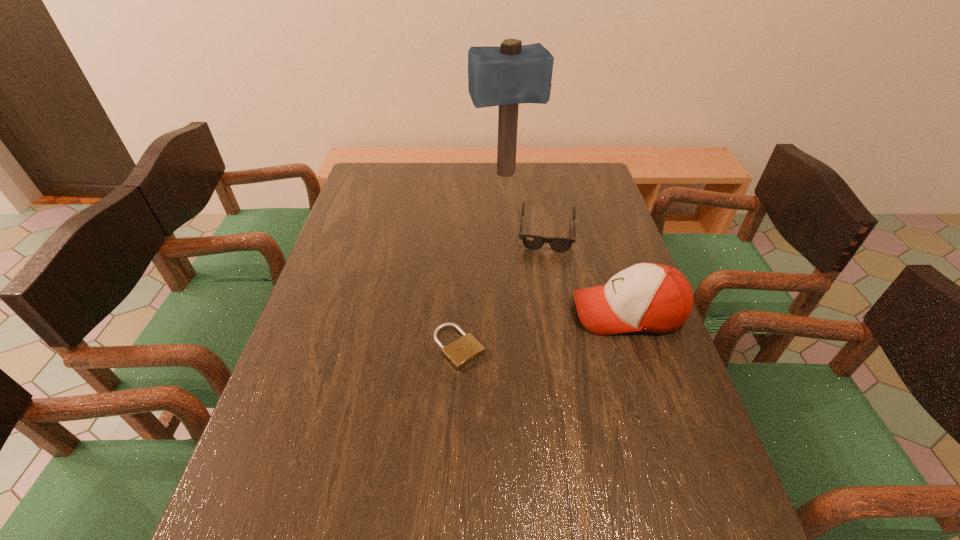
You are a GUI agent. You are given a task and a screenshot of the screen. Output one action in this format:
    pyautogui.click(x=<x>, y=<y>)
    Task: Click on the empty location between the second tallest object and the third nearest object
    This screenshot has height=540, width=960.
    Given the screenshot: What is the action you would take?
    pyautogui.click(x=588, y=273)

Where is `vacant space in between the third shortest object and the padlock`? The height and width of the screenshot is (540, 960). vacant space in between the third shortest object and the padlock is located at coordinates (543, 329).

Find the location of a particular element. The height and width of the screenshot is (540, 960). vacant space that is in between the shortest object and the mallet is located at coordinates (482, 261).

This screenshot has width=960, height=540. What are the coordinates of `vacant point located between the sunglasses and the padlock` in the screenshot? It's located at (503, 290).

Locate an element on the screen. free space between the shortest object and the baseball cap is located at coordinates (543, 329).

Identify which object is located as the third nearest to the third shortest object. Please provide its 2D coordinates. Your answer should be formatted as a tuple, i.e. [(x, y)], where the tuple contains the x and y coordinates of a point satisfying the conditions above.

[(506, 76)]

Choose which object is the third nearest neighbor to the second tallest object. Please provide its 2D coordinates. Your answer should be formatted as a tuple, i.e. [(x, y)], where the tuple contains the x and y coordinates of a point satisfying the conditions above.

[(506, 76)]

This screenshot has width=960, height=540. In order to click on free space that satisfies the following two spatial constraints: 1. on the front side of the sunglasses; 2. on the left side of the farthest object in this screenshot , I will do `click(510, 233)`.